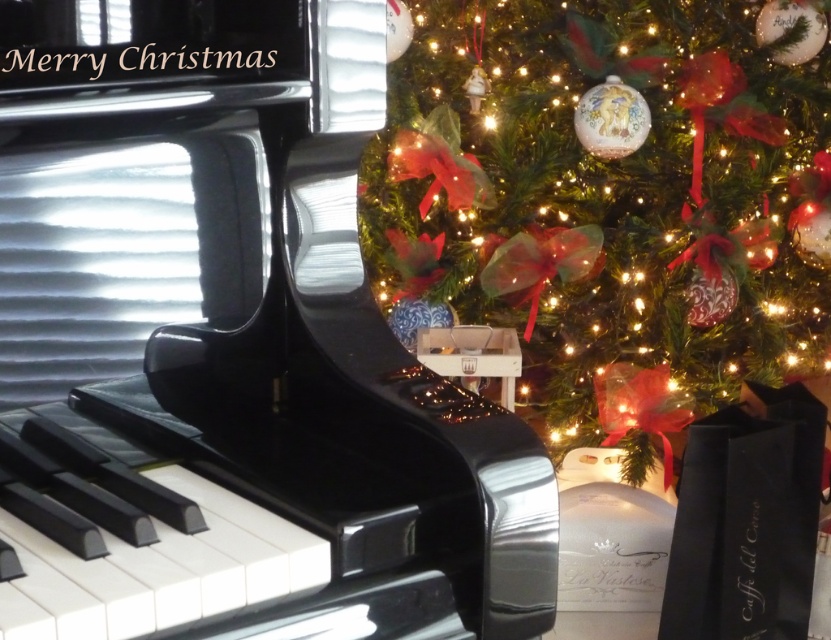
Consider the image. You are a guest at a party and want to take a photo with both the glossy black piano at center and the green matte christmas tree at upper right in the same frame. Which object should you position closer to the camera to ensure both are fully visible?

To ensure both the glossy black piano at center and the green matte christmas tree at upper right are fully visible in the photo, you should position the glossy black piano at center closer to the camera. Since the piano is shorter than the tree, placing it nearer will help balance their sizes in the frame.

You are a guest at a Christmas party and want to take a photo of both the glossy black piano at center and the green matte christmas tree at upper right. To ensure both are in the frame, should you stand to the left or right of the piano?

You should stand to the right of the glossy black piano at center because it is positioned on the left side of the green matte christmas tree at upper right, so standing to the right of the piano will allow you to capture both objects in the frame.

You are standing in the room where the image is taken. The glossy black piano at center is located at coordinates 0.558 on the x axis and 0.282 on the y axis. If you want to move to the piano, which direction should you walk from your current position at the origin point?

Since the glossy black piano at center is located at coordinates 0.558 on the x axis and 0.282 on the y axis, you should walk towards the positive x and positive y direction to reach it.